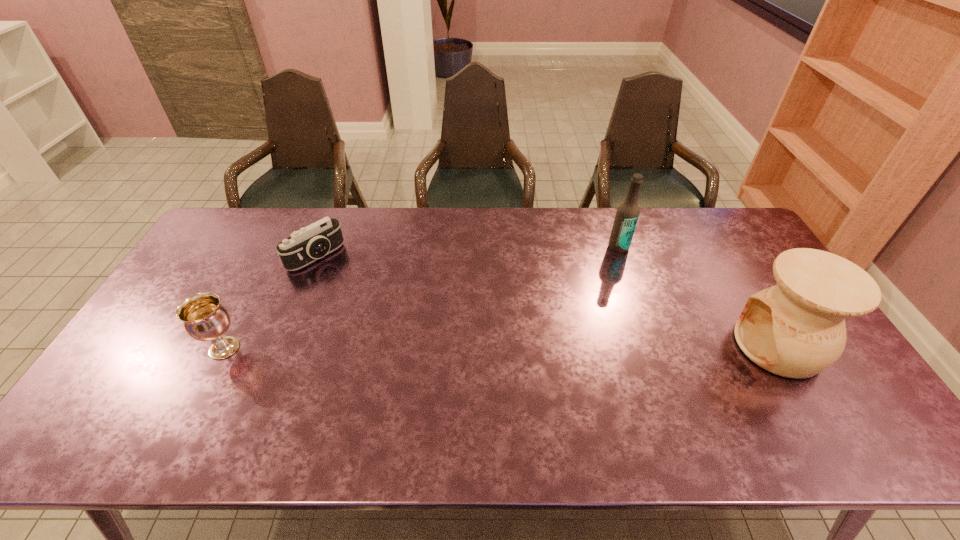
In order to click on free point that satisfies the following two spatial constraints: 1. on the front side of the rightmost object; 2. at the open side of the second object from right to left in this screenshot , I will do `click(653, 346)`.

The height and width of the screenshot is (540, 960). What are the coordinates of `blank space that satisfies the following two spatial constraints: 1. on the back side of the second object from left to right; 2. on the left side of the beer bottle` in the screenshot? It's located at (320, 247).

Find the location of a particular element. The height and width of the screenshot is (540, 960). vacant position in the image that satisfies the following two spatial constraints: 1. on the front side of the second object from left to right; 2. at the open side of the rightmost object is located at coordinates (280, 346).

Locate an element on the screen. The height and width of the screenshot is (540, 960). free spot that satisfies the following two spatial constraints: 1. on the front side of the beer bottle; 2. at the open side of the pottery is located at coordinates (653, 346).